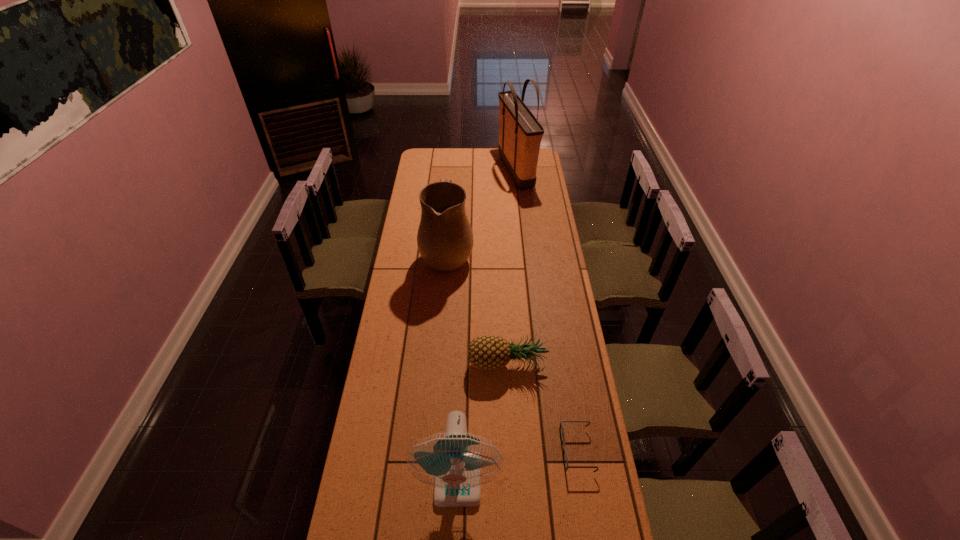
Identify the location of vacant space located 0.100m on the lens of the shortest object. The width and height of the screenshot is (960, 540). (532, 450).

This screenshot has height=540, width=960. I want to click on free space located on the lens of the shortest object, so click(x=546, y=450).

The height and width of the screenshot is (540, 960). Find the location of `vacant position located 0.370m on the lens of the shortest object`. vacant position located 0.370m on the lens of the shortest object is located at coordinates (451, 450).

The width and height of the screenshot is (960, 540). I want to click on object that is at the far edge, so click(x=520, y=134).

The width and height of the screenshot is (960, 540). What are the coordinates of `object located at the left edge` in the screenshot? It's located at (445, 241).

Where is `shopping bag at the right edge`? shopping bag at the right edge is located at coordinates (520, 134).

The width and height of the screenshot is (960, 540). What are the coordinates of `pineapple that is at the right edge` in the screenshot? It's located at (485, 352).

Where is `spectacles located at the right edge`? The width and height of the screenshot is (960, 540). spectacles located at the right edge is located at coordinates (561, 424).

Find the location of `object that is positioned at the far right corner`. object that is positioned at the far right corner is located at coordinates (520, 134).

Identify the location of free space at the far edge of the desktop. (454, 161).